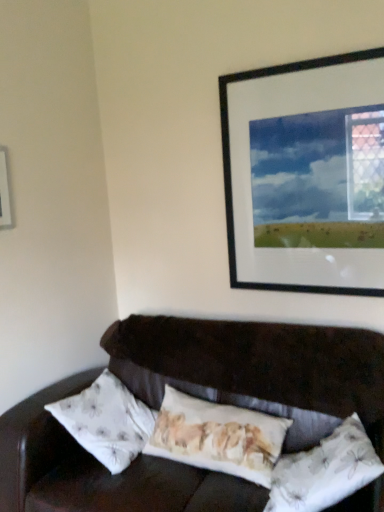
Identify the location of free space above black matte picture frame at upper right, marked as the first picture frame in a right-to-left arrangement (from a real-world perspective). (311, 57).